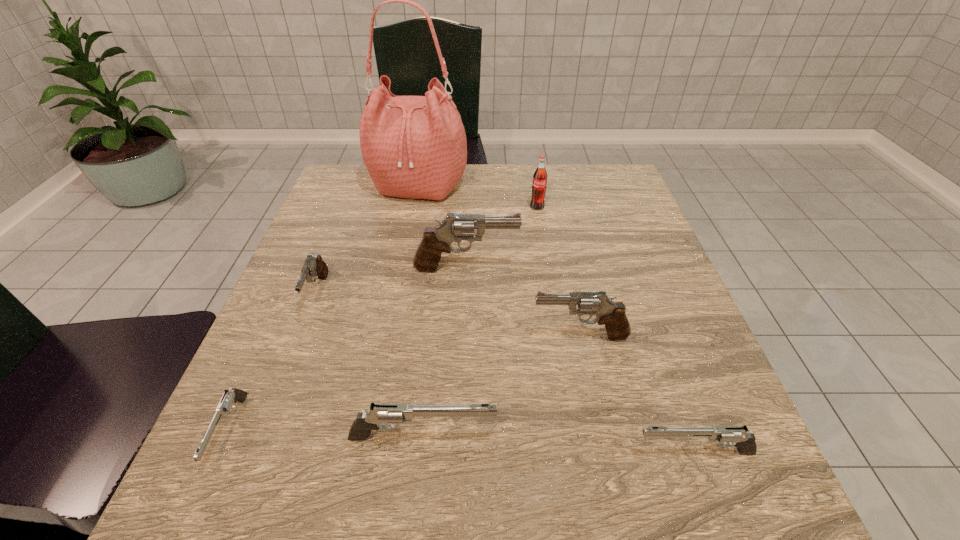
The height and width of the screenshot is (540, 960). In order to click on unoccupied area between the soda bottle and the biggest gray pistol in this screenshot , I will do `click(501, 238)`.

I want to click on empty location between the biggest gray pistol and the soda bottle, so click(501, 238).

Locate an element on the screen. free space between the fifth shortest pistol and the leftmost pistol is located at coordinates coord(404,383).

The image size is (960, 540). Find the location of `vacant space that's between the second smallest gray pistol and the shortest object`. vacant space that's between the second smallest gray pistol and the shortest object is located at coordinates (404, 383).

Where is `free space between the soda bottle and the biggest gray pistol`? free space between the soda bottle and the biggest gray pistol is located at coordinates (501, 238).

The image size is (960, 540). What are the coordinates of `empty space between the fourth nearest pistol and the soda bottle` in the screenshot? It's located at (559, 272).

Identify which object is located as the nearest to the second gray pistol from right to left. Please provide its 2D coordinates. Your answer should be formatted as a tuple, i.e. [(x, y)], where the tuple contains the x and y coordinates of a point satisfying the conditions above.

[(611, 314)]

Identify which object is located as the sixth nearest to the rightmost silver pistol. Please provide its 2D coordinates. Your answer should be formatted as a tuple, i.e. [(x, y)], where the tuple contains the x and y coordinates of a point satisfying the conditions above.

[(539, 183)]

This screenshot has height=540, width=960. Identify the location of pistol that is the third closest to the second object from left to right. (396, 413).

You are a GUI agent. You are given a task and a screenshot of the screen. Output one action in this format:
    pyautogui.click(x=<x>, y=<y>)
    Task: Click on the pistol that is the third closest to the tallest pistol
    This screenshot has width=960, height=540.
    Given the screenshot: What is the action you would take?
    pyautogui.click(x=396, y=413)